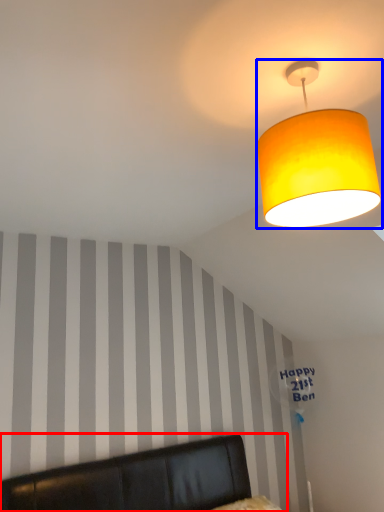
Question: Which of the following is the closest to the observer, furniture (highlighted by a red box) or lamp (highlighted by a blue box)?

Choices:
 (A) furniture
 (B) lamp

Answer: (A)